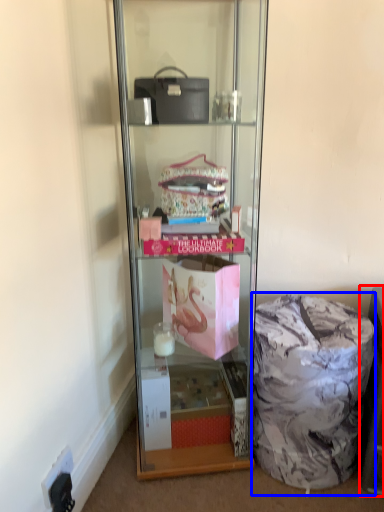
Question: Among these objects, which one is farthest to the camera, cabinet (highlighted by a red box) or garbage (highlighted by a blue box)?

Choices:
 (A) cabinet
 (B) garbage

Answer: (B)